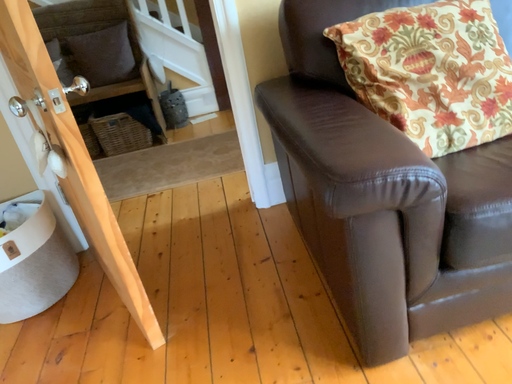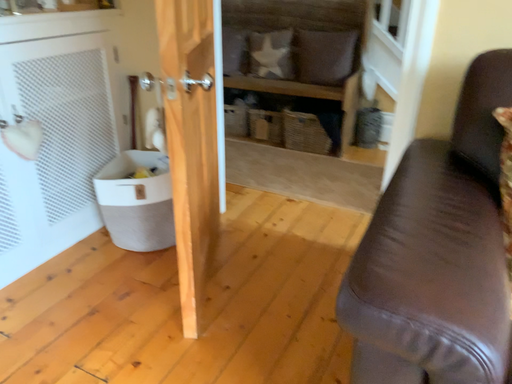
Question: How did the camera likely rotate when shooting the video?

Choices:
 (A) rotated left
 (B) rotated right

Answer: (A)